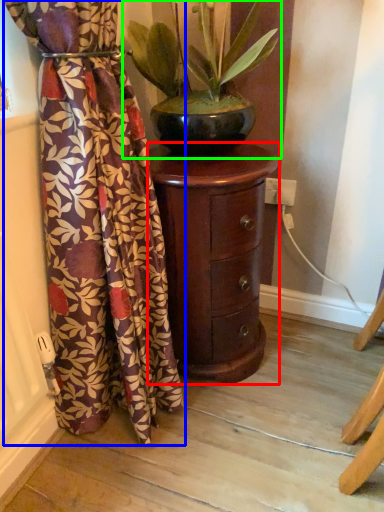
Question: Which object is the closest to the furniture (highlighted by a red box)? Choose among these: curtain (highlighted by a blue box) or houseplant (highlighted by a green box).

Choices:
 (A) curtain
 (B) houseplant

Answer: (A)